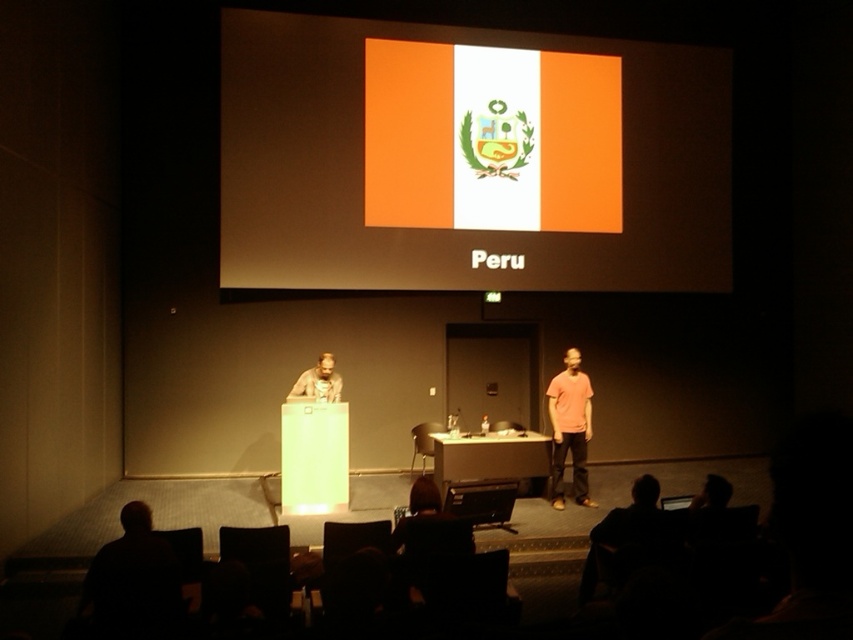
Is point (682, 60) positioned before point (549, 387)?

No, it is behind (549, 387).

I want to click on orange matte flag at upper center, so click(x=467, y=157).

Can you confirm if orange matte flag at upper center is taller than matte wooden podium at center?

Yes.

From the picture: Who is taller, orange matte flag at upper center or matte wooden podium at center?

Standing taller between the two is orange matte flag at upper center.

Describe the element at coordinates (467, 157) in the screenshot. I see `orange matte flag at upper center` at that location.

At what (x,y) coordinates should I click in order to perform the action: click on orange matte flag at upper center. Please return your answer as a coordinate pair (x, y). Looking at the image, I should click on (467, 157).

Between orange cotton t-shirt at right and matte wooden podium at center, which one has more height?

Standing taller between the two is orange cotton t-shirt at right.

You are a GUI agent. You are given a task and a screenshot of the screen. Output one action in this format:
    pyautogui.click(x=<x>, y=<y>)
    Task: Click on the orange cotton t-shirt at right
    Image resolution: width=853 pixels, height=640 pixels.
    Given the screenshot: What is the action you would take?
    pyautogui.click(x=569, y=428)